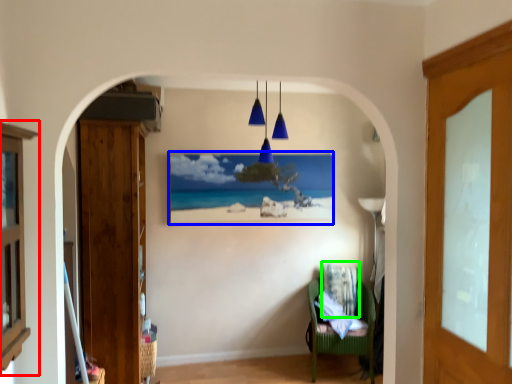
Question: Estimate the real-world distances between objects in this image. Which object is closer to cabinetry (highlighted by a red box), picture frame (highlighted by a blue box) or pillow (highlighted by a green box)?

Choices:
 (A) picture frame
 (B) pillow

Answer: (A)